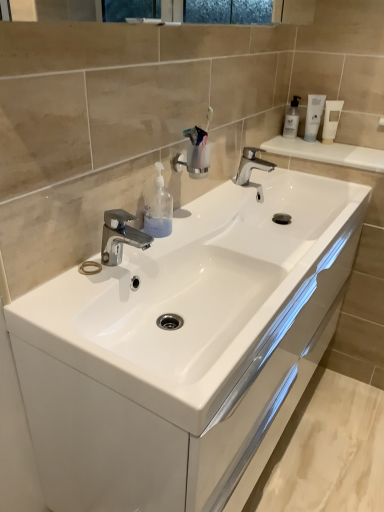
Question: Is white glossy tube at upper right, which ranks as the 3th mouthwash in left-to-right order, to the left of transparent plastic soap dispenser at center from the viewer's perspective?

Choices:
 (A) no
 (B) yes

Answer: (A)

Question: Does white glossy tube at upper right, the first mouthwash from the right, come in front of transparent plastic soap dispenser at center?

Choices:
 (A) no
 (B) yes

Answer: (A)

Question: Is the position of white glossy tube at upper right, which ranks as the 3th mouthwash in left-to-right order, more distant than that of transparent plastic soap dispenser at center?

Choices:
 (A) yes
 (B) no

Answer: (A)

Question: From the image's perspective, does white glossy tube at upper right, which ranks as the 3th mouthwash in left-to-right order, appear lower than transparent plastic soap dispenser at center?

Choices:
 (A) yes
 (B) no

Answer: (B)

Question: From a real-world perspective, is white glossy tube at upper right, the first mouthwash from the right, positioned under transparent plastic soap dispenser at center based on gravity?

Choices:
 (A) yes
 (B) no

Answer: (B)

Question: Choose the correct answer: Is white glossy tube at upper right, the first mouthwash from the right, inside transparent plastic mouthwash at upper right, which ranks as the 1th mouthwash in left-to-right order, or outside it?

Choices:
 (A) outside
 (B) inside

Answer: (A)

Question: Considering the positions of white glossy tube at upper right, the first mouthwash from the right, and transparent plastic mouthwash at upper right, which ranks as the 1th mouthwash in left-to-right order, in the image, is white glossy tube at upper right, the first mouthwash from the right, bigger or smaller than transparent plastic mouthwash at upper right, which ranks as the 1th mouthwash in left-to-right order,?

Choices:
 (A) big
 (B) small

Answer: (B)

Question: Is white glossy tube at upper right, the first mouthwash from the right, taller or shorter than transparent plastic mouthwash at upper right, which ranks as the 1th mouthwash in left-to-right order?

Choices:
 (A) short
 (B) tall

Answer: (B)

Question: Is point (334, 133) closer or farther from the camera than point (291, 134)?

Choices:
 (A) farther
 (B) closer

Answer: (B)

Question: Do you think white glossy cabinet at center is within white glossy mouthwash at upper right, the 2th mouthwash positioned from the right, or outside of it?

Choices:
 (A) outside
 (B) inside

Answer: (A)

Question: In the image, is white glossy cabinet at center on the left side or the right side of white glossy mouthwash at upper right, the 2th mouthwash positioned from the right?

Choices:
 (A) left
 (B) right

Answer: (A)

Question: Considering the positions of white glossy cabinet at center and white glossy mouthwash at upper right, the 2th mouthwash positioned from the right, in the image, is white glossy cabinet at center bigger or smaller than white glossy mouthwash at upper right, the 2th mouthwash positioned from the right,?

Choices:
 (A) small
 (B) big

Answer: (B)

Question: Is white glossy cabinet at center in front of or behind white glossy mouthwash at upper right, the 2th mouthwash positioned from the right, in the image?

Choices:
 (A) behind
 (B) front

Answer: (B)

Question: In the image, is white glossy cabinet at center positioned in front of or behind white glossy tube at upper right, which ranks as the 3th mouthwash in left-to-right order?

Choices:
 (A) front
 (B) behind

Answer: (A)

Question: Based on their positions, is white glossy cabinet at center located to the left or right of white glossy tube at upper right, the first mouthwash from the right?

Choices:
 (A) left
 (B) right

Answer: (A)